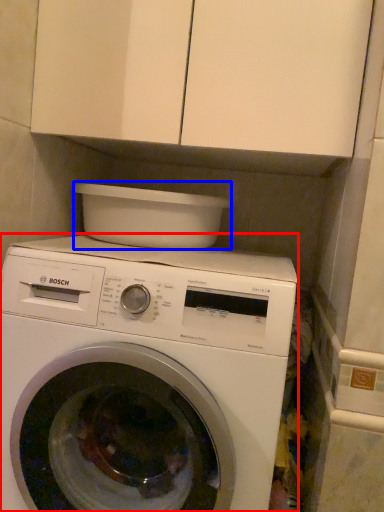
Question: Which object is closer to the camera taking this photo, washing machine (highlighted by a red box) or appliance (highlighted by a blue box)?

Choices:
 (A) washing machine
 (B) appliance

Answer: (A)